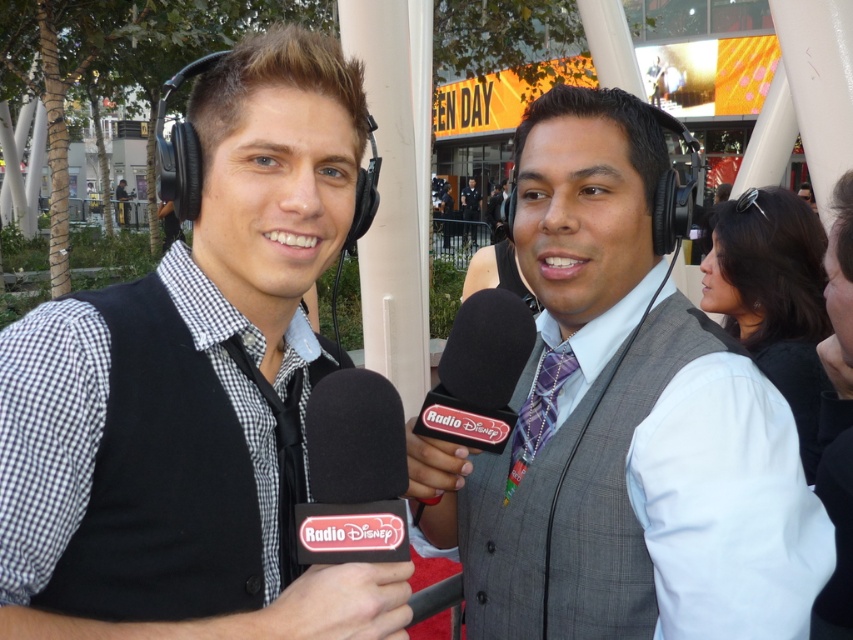
Question: Does purple plaid tie at center appear over matte black vest at center?

Choices:
 (A) no
 (B) yes

Answer: (A)

Question: Which of the following is the farthest from the observer?

Choices:
 (A) (538, 444)
 (B) (310, 538)

Answer: (A)

Question: Which object appears closest to the camera in this image?

Choices:
 (A) matte gray vest at center
 (B) black plastic microphone at center

Answer: (A)

Question: Is matte gray vest at center smaller than purple plaid tie at center?

Choices:
 (A) yes
 (B) no

Answer: (B)

Question: Does matte gray vest at center appear on the left side of gray plaid vest at center?

Choices:
 (A) no
 (B) yes

Answer: (B)

Question: Estimate the real-world distances between objects in this image. Which object is closer to the matte gray vest at center?

Choices:
 (A) purple plaid tie at center
 (B) black plastic microphone at center
 (C) black foam microphone at center

Answer: (A)